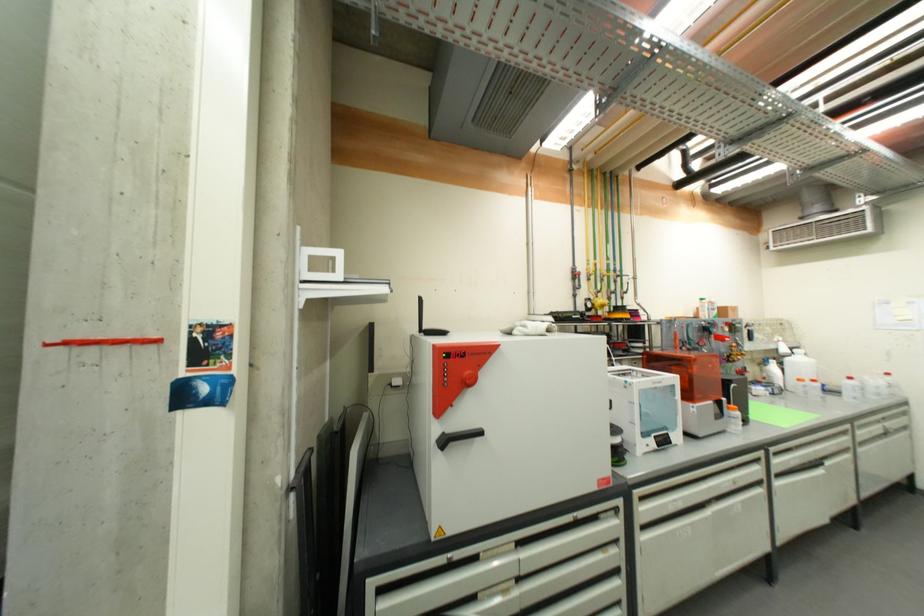
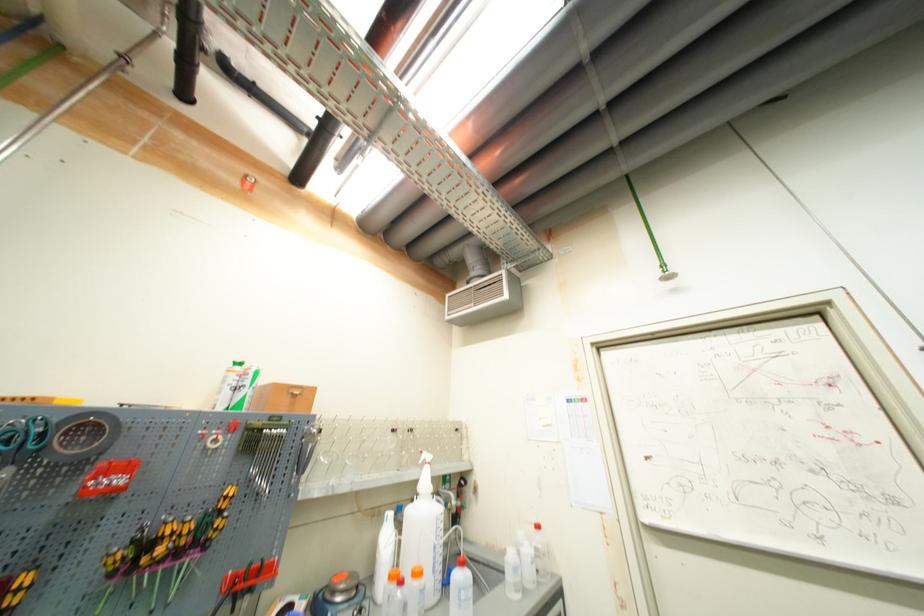
Locate, in the second image, the point that corresponds to pixel 891 392 in the first image.

(533, 578)